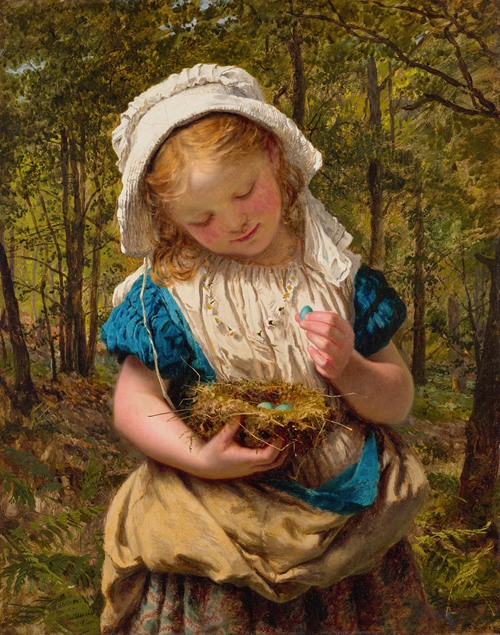
Identify the location of painting. Image resolution: width=500 pixels, height=635 pixels. (246, 35).